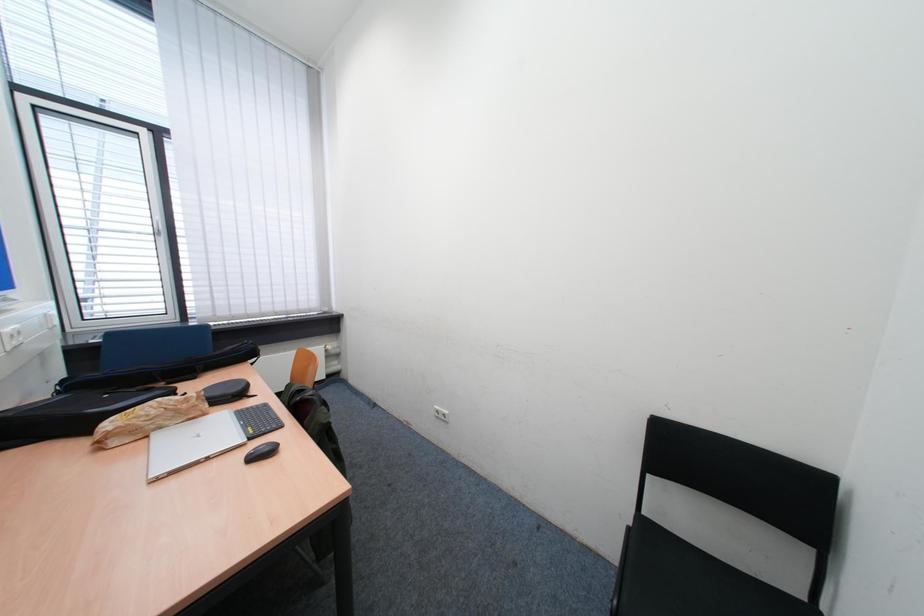
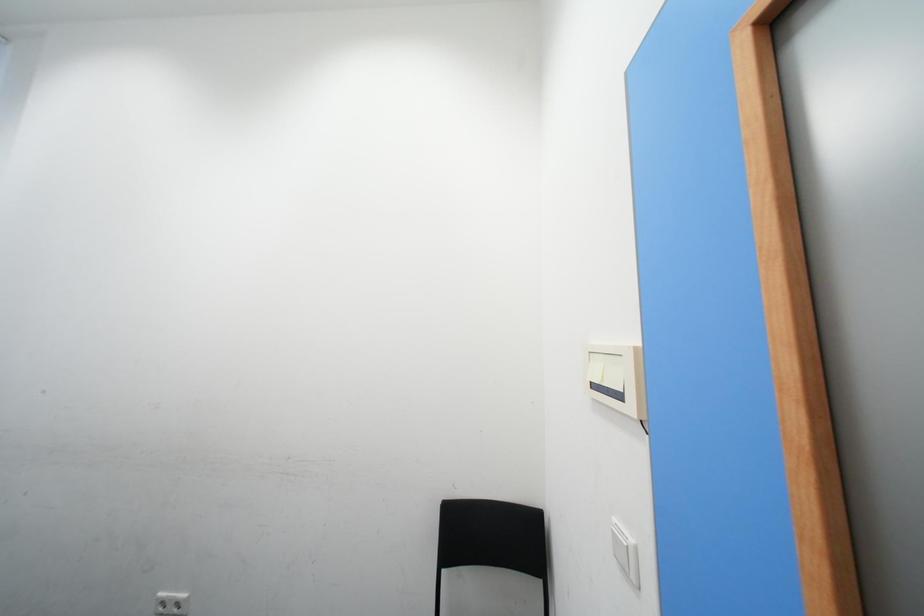
Question: How did the camera likely rotate?

Choices:
 (A) Left
 (B) Right
 (C) Up
 (D) Down

Answer: (B)